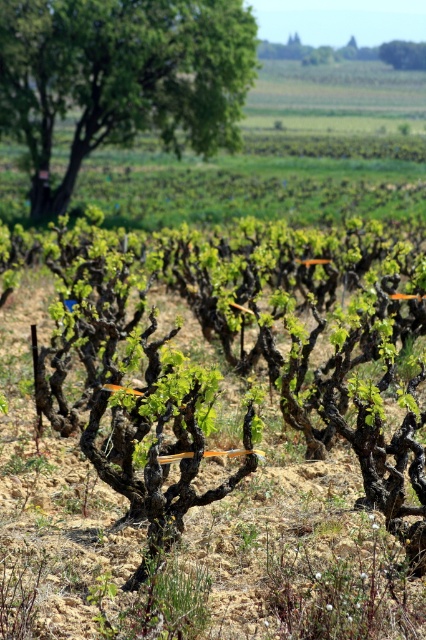
You are standing in the vineyard scene described. You notice a point marked at coordinates (120, 77). What object is located at that point?

The point at coordinates (120, 77) indicates a green leafy tree at upper left.

You are a hiker who has just arrived at the vineyard and wants to take a photo with the green leafy tree at upper left and the green leafy tree at upper center in the background. Which tree should you stand closer to in order to have both trees clearly visible in your photo?

You should stand closer to the green leafy tree at upper left since it is taller than the green leafy tree at upper center. By positioning yourself nearer to the taller tree, both trees will be more balanced in size within the frame, ensuring they are both clearly visible in your photo.